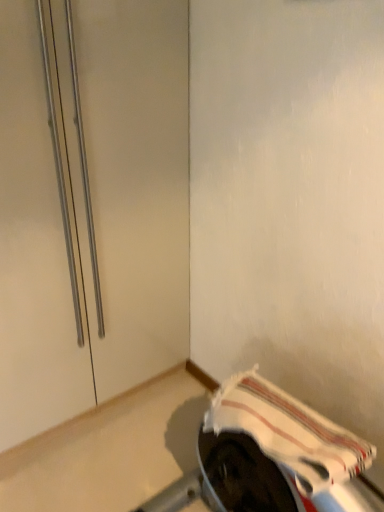
Where is `white striped towel at lower right`? The width and height of the screenshot is (384, 512). white striped towel at lower right is located at coordinates (288, 433).

Image resolution: width=384 pixels, height=512 pixels. What do you see at coordinates (288, 433) in the screenshot?
I see `white striped towel at lower right` at bounding box center [288, 433].

Where is `white striped towel at lower right`? The image size is (384, 512). white striped towel at lower right is located at coordinates (288, 433).